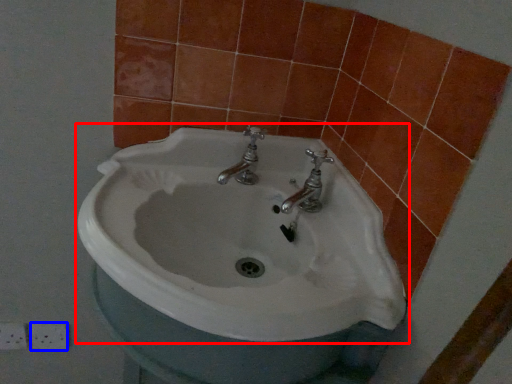
Question: Which object appears closest to the camera in this image, sink (highlighted by a red box) or ceramic tile (highlighted by a blue box)?

Choices:
 (A) sink
 (B) ceramic tile

Answer: (A)